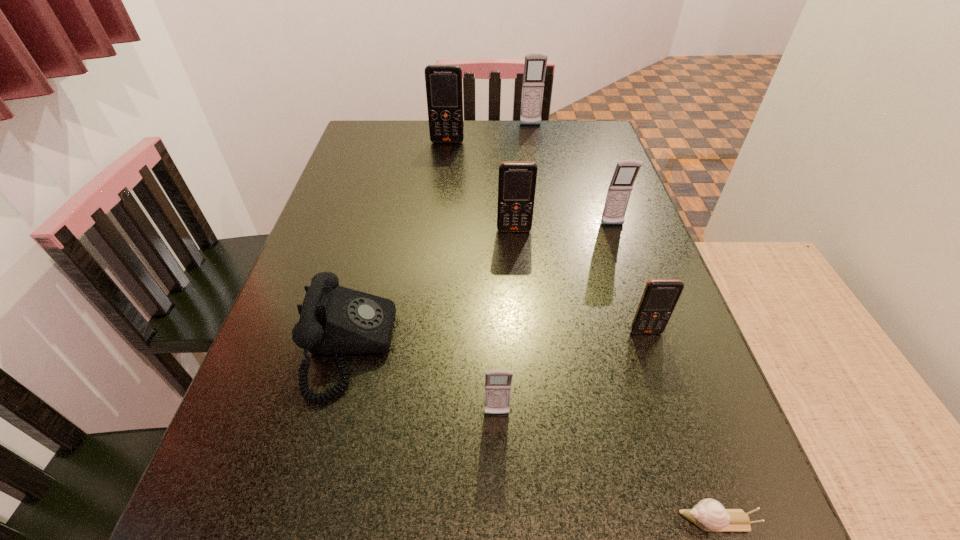
At what (x,y) coordinates should I click in order to perform the action: click on the fourth cellular telephone from left to right. Please return your answer as a coordinate pair (x, y). The image size is (960, 540). Looking at the image, I should click on (535, 64).

Locate an element on the screen. the farthest cellular telephone is located at coordinates (535, 64).

Find the location of a particular element. The height and width of the screenshot is (540, 960). the leftmost cellular telephone is located at coordinates (444, 93).

Find the location of `the fifth nearest cellular telephone`. the fifth nearest cellular telephone is located at coordinates (444, 93).

The width and height of the screenshot is (960, 540). Identify the location of the second biggest gray cellular telephone. (620, 188).

Find the location of a particular element. the rightmost gray cellular telephone is located at coordinates (620, 188).

Where is `the second farthest orange cellular telephone`? The image size is (960, 540). the second farthest orange cellular telephone is located at coordinates (517, 180).

The width and height of the screenshot is (960, 540). I want to click on the second biggest orange cellular telephone, so click(x=517, y=180).

This screenshot has height=540, width=960. In order to click on the second nearest cellular telephone in this screenshot , I will do `click(660, 297)`.

I want to click on the smallest orange cellular telephone, so click(x=660, y=297).